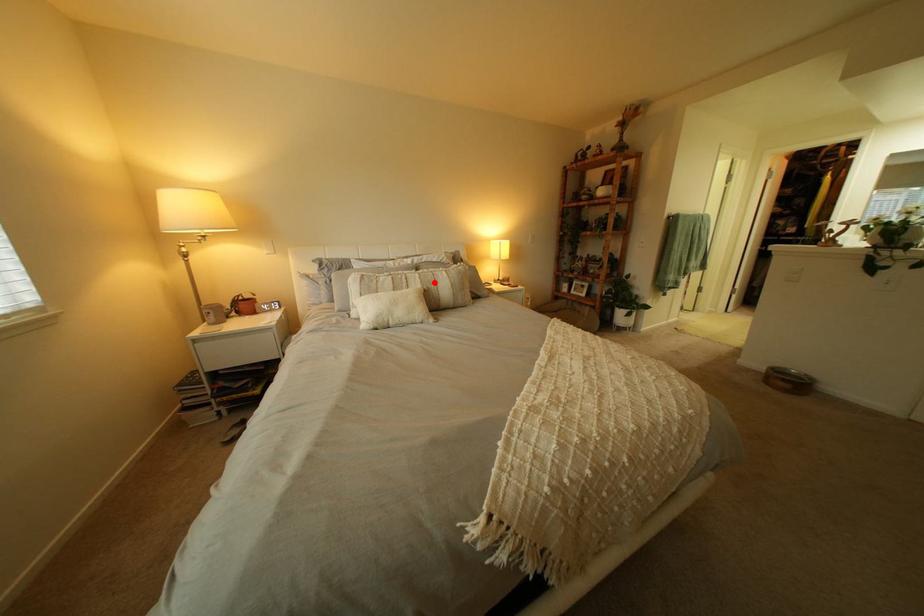
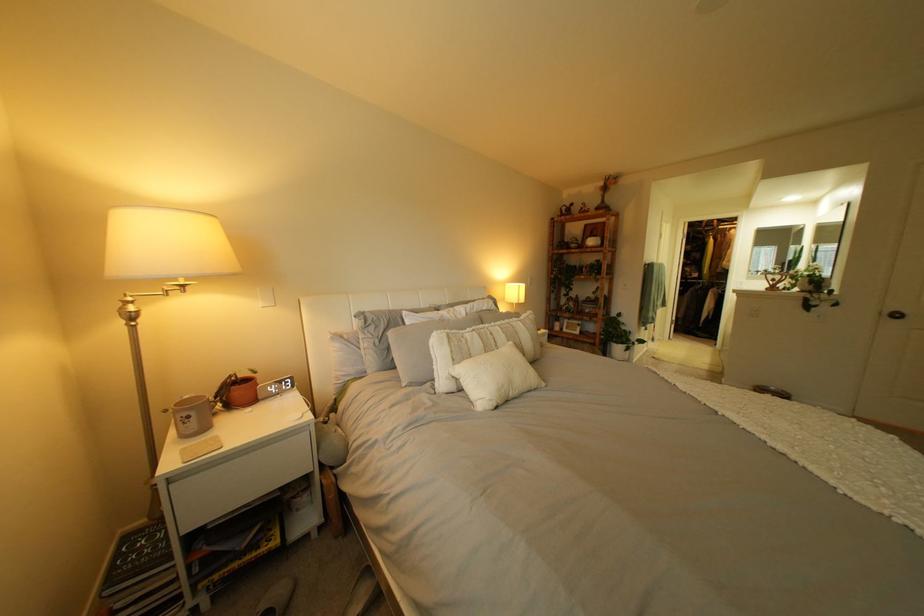
Locate, in the second image, the point that corresponds to the highlighted location in the first image.

(518, 337)